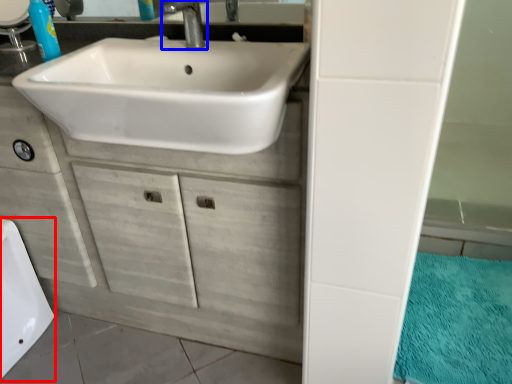
Question: Which object is further to the camera taking this photo, bath (highlighted by a red box) or tap (highlighted by a blue box)?

Choices:
 (A) bath
 (B) tap

Answer: (A)